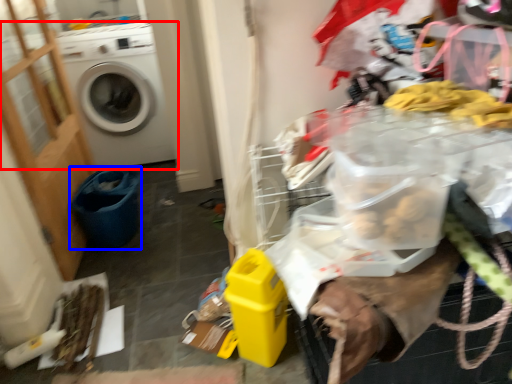
Question: Which object appears farthest to the camera in this image, washing machine (highlighted by a red box) or recycling bin (highlighted by a blue box)?

Choices:
 (A) washing machine
 (B) recycling bin

Answer: (A)